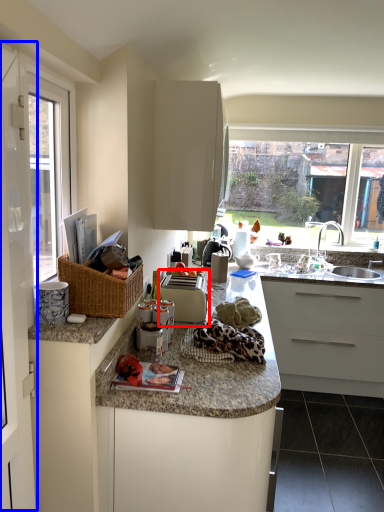
Question: Which of the following is the farthest to the observer, appliance (highlighted by a red box) or screen door (highlighted by a blue box)?

Choices:
 (A) appliance
 (B) screen door

Answer: (A)